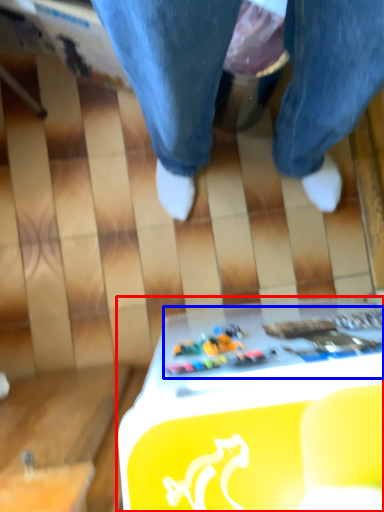
Question: Among these objects, which one is nearest to the camera, table (highlighted by a red box) or writing (highlighted by a blue box)?

Choices:
 (A) table
 (B) writing

Answer: (A)